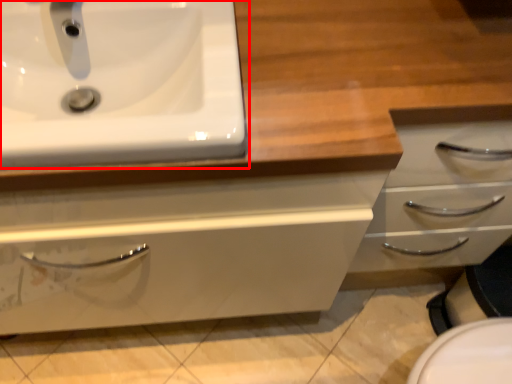
Question: Observing the image, what is the correct spatial positioning of sink (annotated by the red box) in reference to plumbing fixture?

Choices:
 (A) left
 (B) right

Answer: (B)